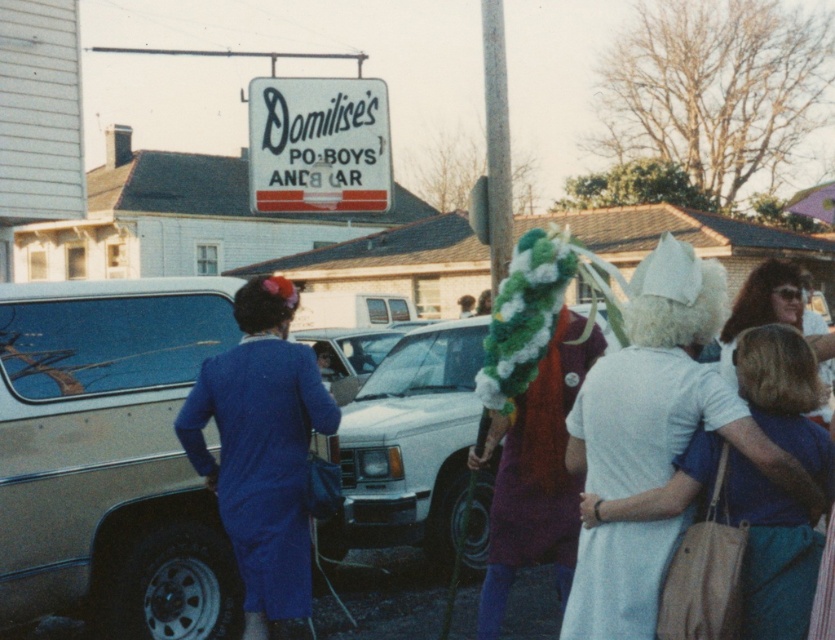
Is matte gold minivan at left taller than matte blue dress at left?

Yes, matte gold minivan at left is taller than matte blue dress at left.

Which of these two, matte gold minivan at left or matte blue dress at left, stands shorter?

matte blue dress at left is shorter.

Identify the location of matte gold minivan at left. (110, 456).

Image resolution: width=835 pixels, height=640 pixels. I want to click on matte gold minivan at left, so click(110, 456).

Is matte gold minivan at left to the right of white glossy car at center from the viewer's perspective?

Incorrect, matte gold minivan at left is not on the right side of white glossy car at center.

Does matte gold minivan at left have a greater height compared to white glossy car at center?

Correct, matte gold minivan at left is much taller as white glossy car at center.

Is point (130, 604) less distant than point (444, 369)?

Yes.

Find the location of a particular element. The height and width of the screenshot is (640, 835). matte gold minivan at left is located at coordinates point(110,456).

Can you confirm if matte blue dress at left is wider than white cotton dress at center?

Indeed, matte blue dress at left has a greater width compared to white cotton dress at center.

Between matte blue dress at left and white cotton dress at center, which one appears on the left side from the viewer's perspective?

matte blue dress at left

Is point (287, 419) positioned after point (795, 522)?

Yes, point (287, 419) is behind point (795, 522).

You are a GUI agent. You are given a task and a screenshot of the screen. Output one action in this format:
    pyautogui.click(x=<x>, y=<y>)
    Task: Click on the matte blue dress at left
    This screenshot has width=835, height=640.
    Given the screenshot: What is the action you would take?
    pyautogui.click(x=261, y=449)